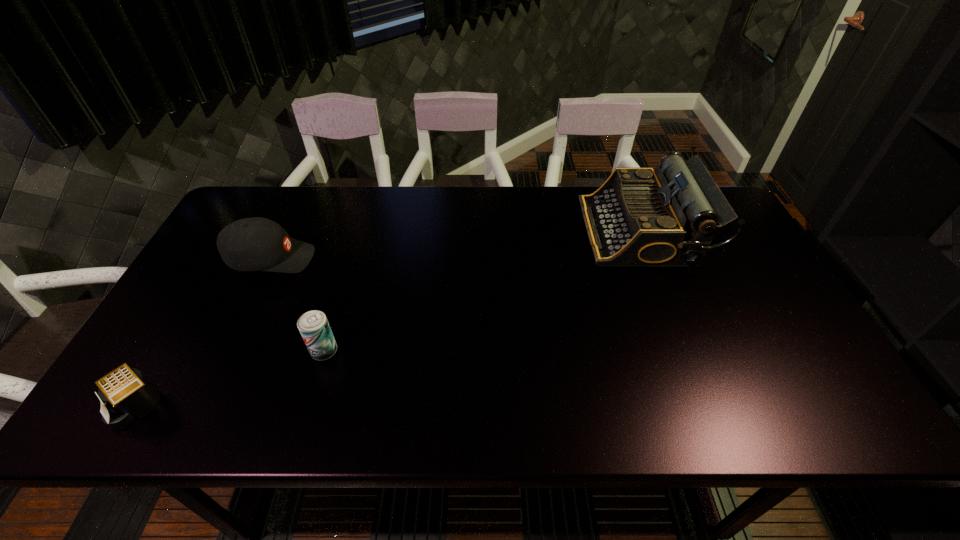
The width and height of the screenshot is (960, 540). I want to click on unoccupied area between the second object from right to left and the nearest object, so click(231, 378).

The height and width of the screenshot is (540, 960). I want to click on vacant region between the rightmost object and the second nearest object, so click(483, 291).

This screenshot has height=540, width=960. What are the coordinates of `free space between the typewriter and the baseball cap` in the screenshot? It's located at (456, 245).

Where is `free space between the second nearest object and the shortest object`? This screenshot has width=960, height=540. free space between the second nearest object and the shortest object is located at coordinates (231, 378).

Where is `free space that is in between the baseball cap and the calculator`? free space that is in between the baseball cap and the calculator is located at coordinates click(205, 332).

Find the location of a particular element. The width and height of the screenshot is (960, 540). object that stands as the third closest to the nearest object is located at coordinates (639, 217).

Identify which object is the third closest to the shortest object. Please provide its 2D coordinates. Your answer should be formatted as a tuple, i.e. [(x, y)], where the tuple contains the x and y coordinates of a point satisfying the conditions above.

[(639, 217)]

Locate an element on the screen. This screenshot has width=960, height=540. free spot that satisfies the following two spatial constraints: 1. with a logo on the front of the beer can; 2. on the left side of the baseball cap is located at coordinates (228, 351).

Image resolution: width=960 pixels, height=540 pixels. Identify the location of free space that satisfies the following two spatial constraints: 1. with a logo on the front of the baseball cap; 2. on the back side of the second nearest object. (228, 351).

Where is `blank space that satisfies the following two spatial constraints: 1. on the keyboard of the typewriter; 2. on the front side of the second nearest object`? The image size is (960, 540). blank space that satisfies the following two spatial constraints: 1. on the keyboard of the typewriter; 2. on the front side of the second nearest object is located at coordinates (688, 351).